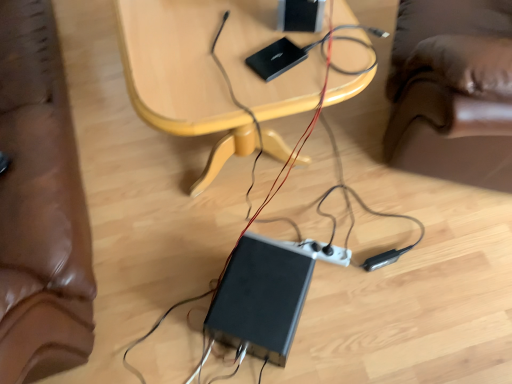
Question: Choose the correct answer: Is black plastic computer at lower center inside wooden table at center or outside it?

Choices:
 (A) inside
 (B) outside

Answer: (B)

Question: From a real-world perspective, relative to wooden table at center, is black plastic computer at lower center vertically above or below?

Choices:
 (A) above
 (B) below

Answer: (B)

Question: Considering the positions of black plastic computer at lower center and wooden table at center in the image, is black plastic computer at lower center wider or thinner than wooden table at center?

Choices:
 (A) wide
 (B) thin

Answer: (B)

Question: Considering the positions of wooden table at center and black plastic computer at lower center in the image, is wooden table at center taller or shorter than black plastic computer at lower center?

Choices:
 (A) short
 (B) tall

Answer: (B)

Question: Is wooden table at center wider or thinner than black plastic computer at lower center?

Choices:
 (A) wide
 (B) thin

Answer: (A)

Question: From a real-world perspective, is wooden table at center physically located above or below black plastic computer at lower center?

Choices:
 (A) below
 (B) above

Answer: (B)

Question: From the image's perspective, relative to black plastic computer at lower center, is wooden table at center above or below?

Choices:
 (A) below
 (B) above

Answer: (B)